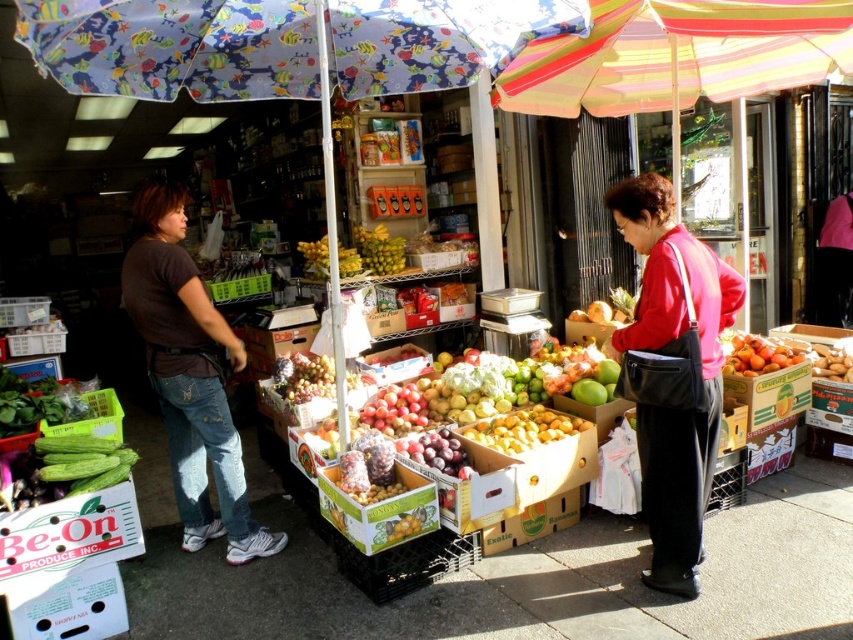
Question: Among these objects, which one is farthest from the camera?

Choices:
 (A) matte red sweater at center
 (B) green matte bananas at center
 (C) yellow matte plums at center
 (D) brown cotton shirt at left

Answer: (B)

Question: Does brown cotton shirt at left appear over yellow matte bananas at center?

Choices:
 (A) yes
 (B) no

Answer: (B)

Question: Which object is positioned closest to the shiny purple plums at center?

Choices:
 (A) ripe red tomatoes at center
 (B) yellow matte bananas at center

Answer: (B)

Question: Which object appears closest to the camera in this image?

Choices:
 (A) shiny purple plums at center
 (B) ripe red tomatoes at center
 (C) brown cotton shirt at left
 (D) yellow matte plums at center

Answer: (A)

Question: Considering the relative positions of ripe red tomatoes at center and green matte bananas at center in the image provided, where is ripe red tomatoes at center located with respect to green matte bananas at center?

Choices:
 (A) right
 (B) left

Answer: (A)

Question: Observing the image, what is the correct spatial positioning of brown cotton shirt at left in reference to ripe red tomatoes at center?

Choices:
 (A) left
 (B) right

Answer: (A)